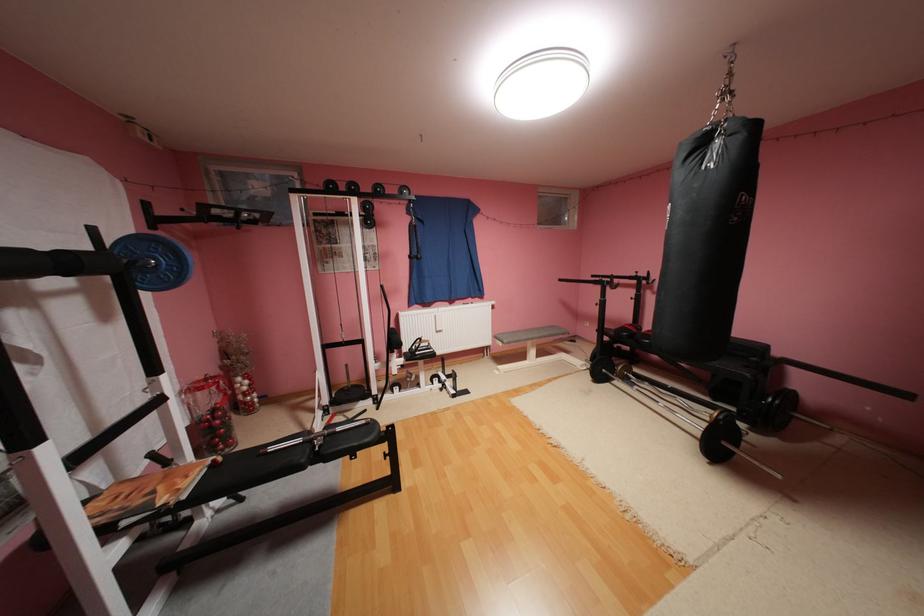
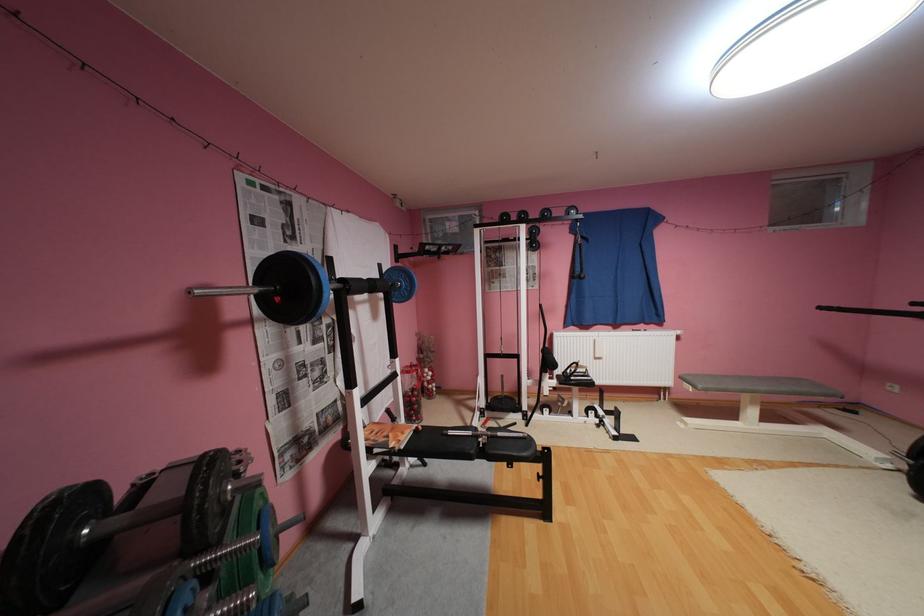
Where in the second image is the point corresponding to [544,334] from the first image?

(771, 387)